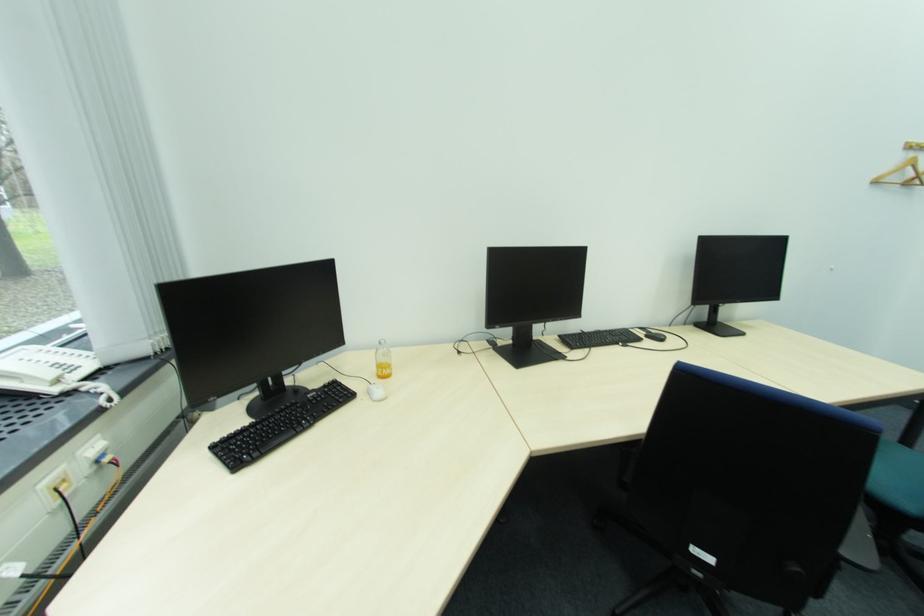
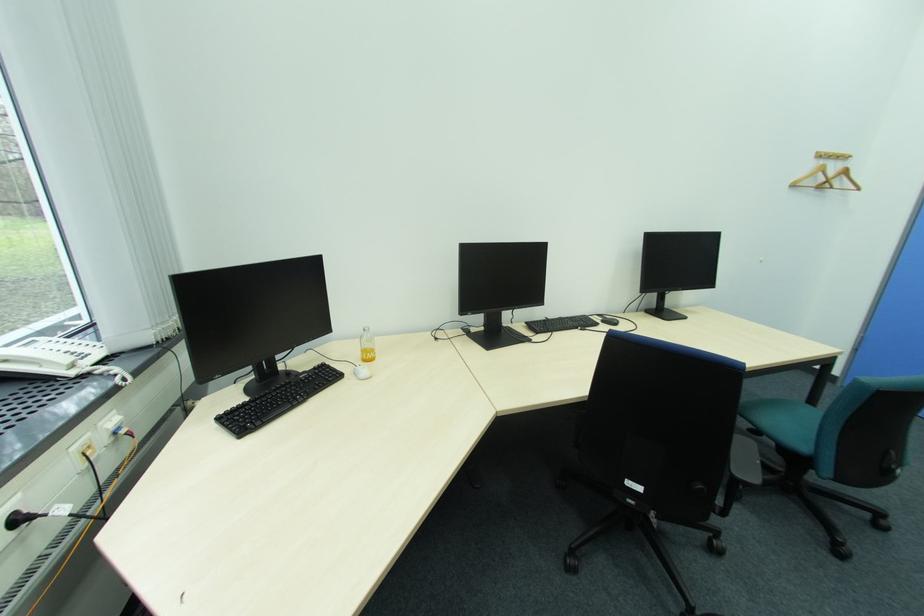
Question: What movement of the cameraman would produce the second image?

Choices:
 (A) Left
 (B) Right
 (C) Forward
 (D) Backward

Answer: (D)